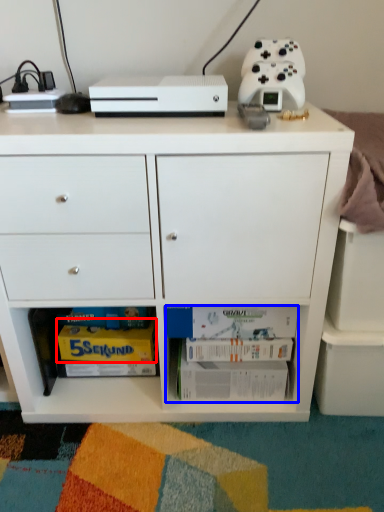
Question: Which object appears closest to the camera in this image, magazine (highlighted by a red box) or book (highlighted by a blue box)?

Choices:
 (A) magazine
 (B) book

Answer: (B)